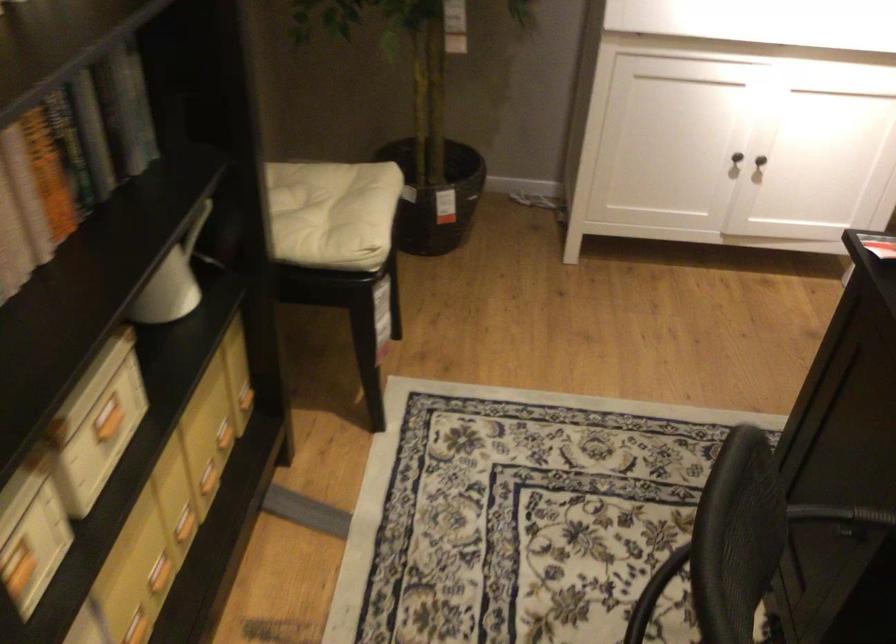
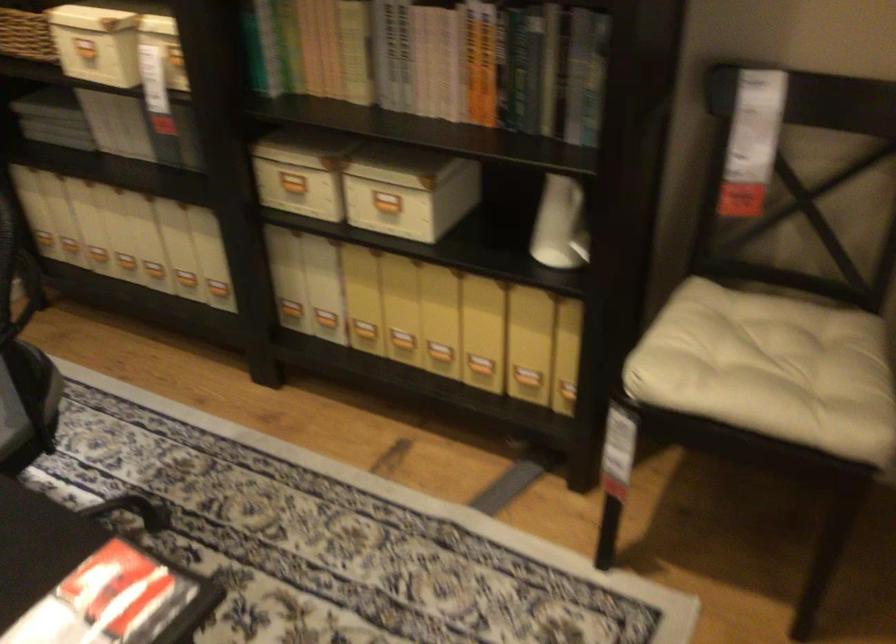
Locate, in the second image, the point that corresponds to (319,219) in the first image.

(776, 366)